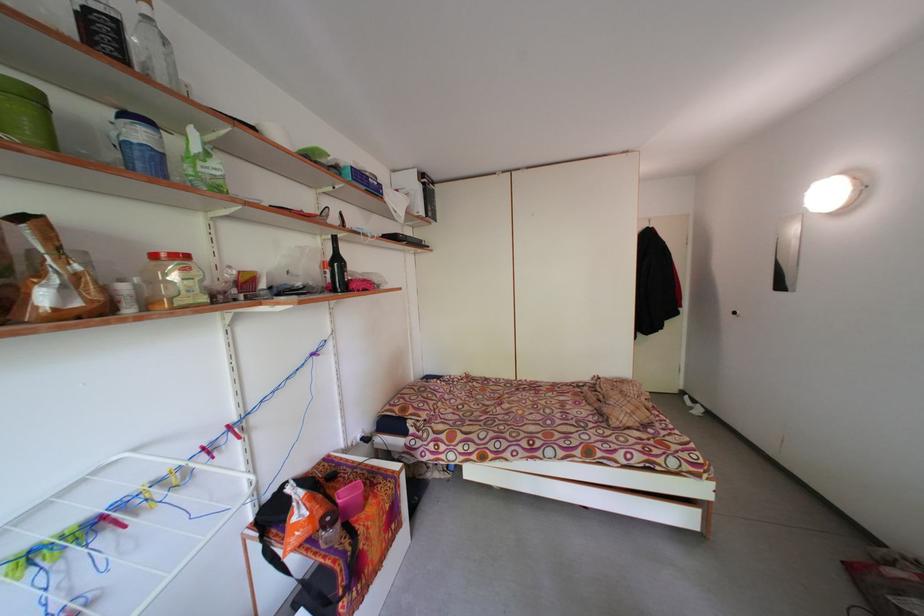
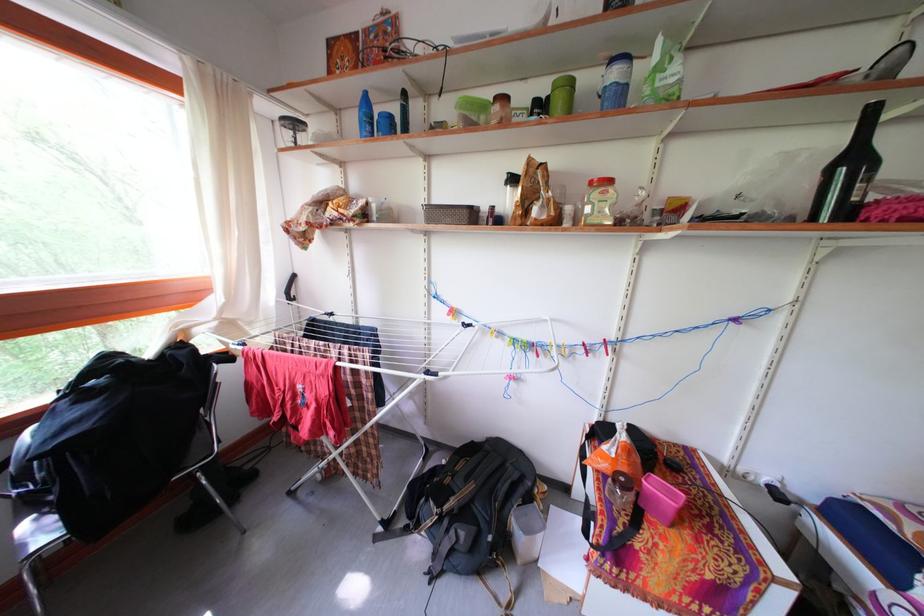
Locate, in the second image, the point that corresponds to [347,530] in the first image.

(638, 504)